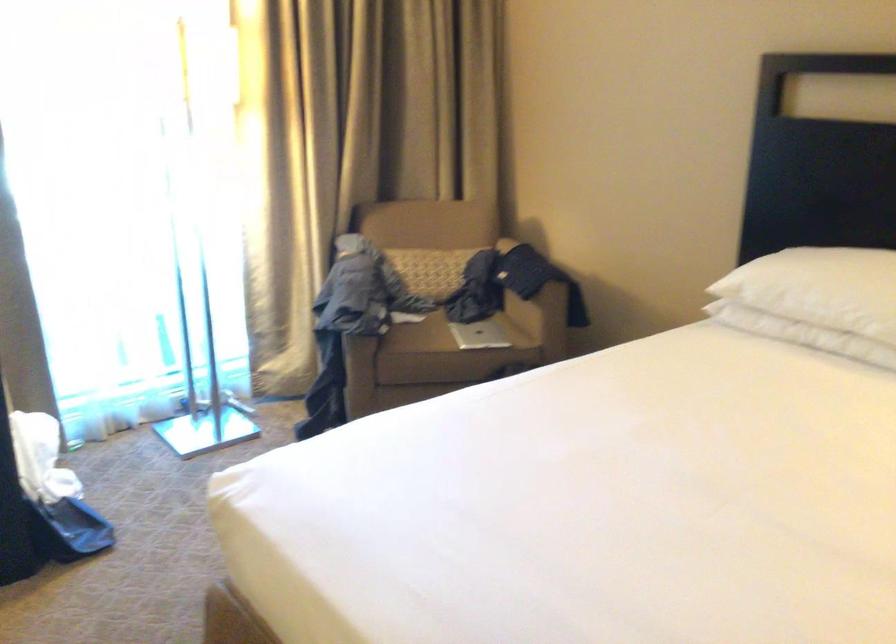
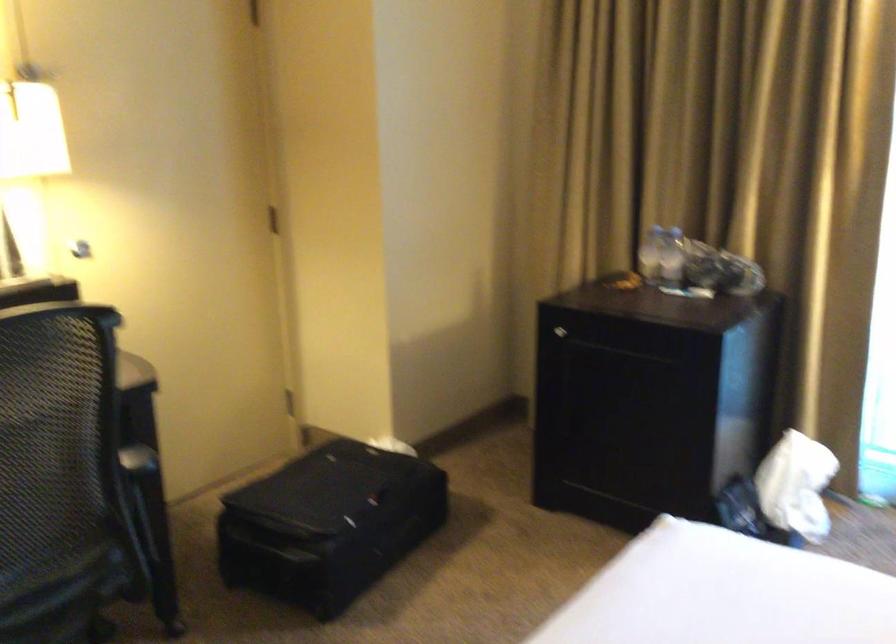
Question: The images are taken continuously from a first-person perspective. In which direction is your viewpoint rotating?

Choices:
 (A) Left
 (B) Right
 (C) Up
 (D) Down

Answer: (A)